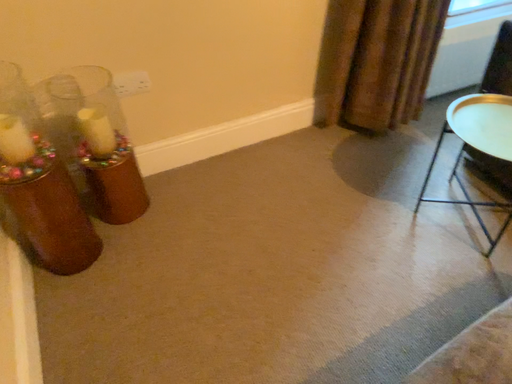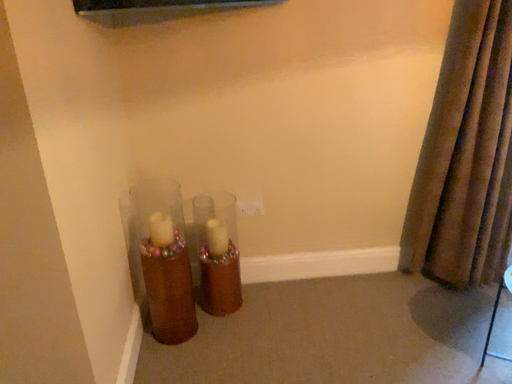
Question: How did the camera likely rotate when shooting the video?

Choices:
 (A) rotated left
 (B) rotated right

Answer: (A)